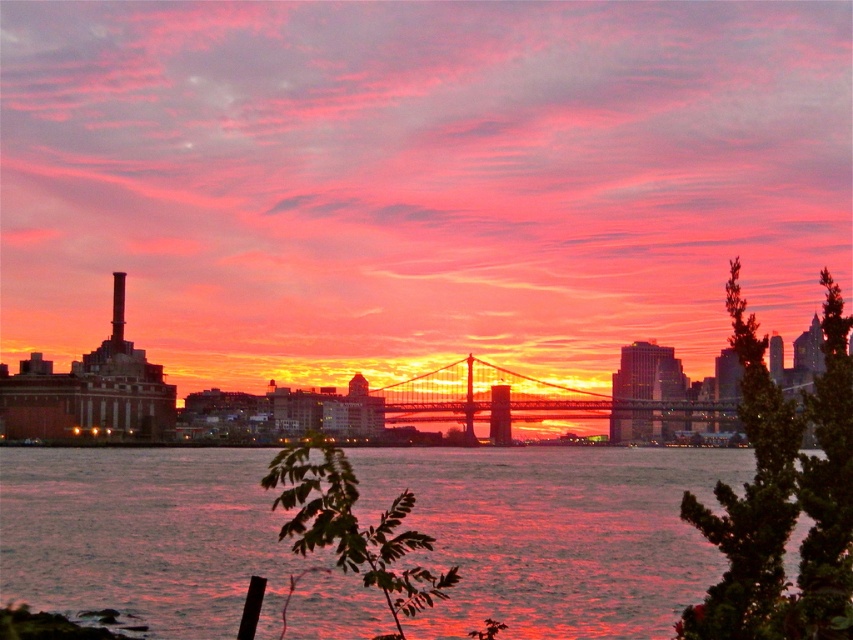
Question: Does shiny metallic water at center come in front of metallic bridge at center?

Choices:
 (A) yes
 (B) no

Answer: (A)

Question: Which object appears closest to the camera in this image?

Choices:
 (A) metallic bridge at center
 (B) shiny metallic water at center

Answer: (B)

Question: Can you confirm if shiny metallic water at center is positioned to the right of metallic bridge at center?

Choices:
 (A) no
 (B) yes

Answer: (A)

Question: Which point appears closest to the camera in this image?

Choices:
 (A) (657, 396)
 (B) (456, 454)

Answer: (B)

Question: Which point appears farthest from the camera in this image?

Choices:
 (A) (550, 500)
 (B) (587, 396)

Answer: (B)

Question: Does shiny metallic water at center appear on the right side of metallic bridge at center?

Choices:
 (A) yes
 (B) no

Answer: (B)